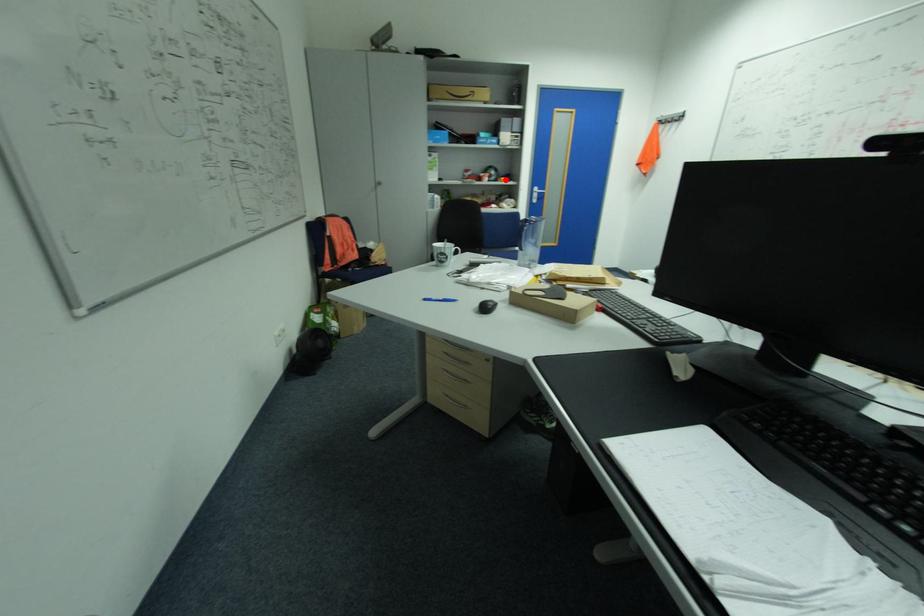
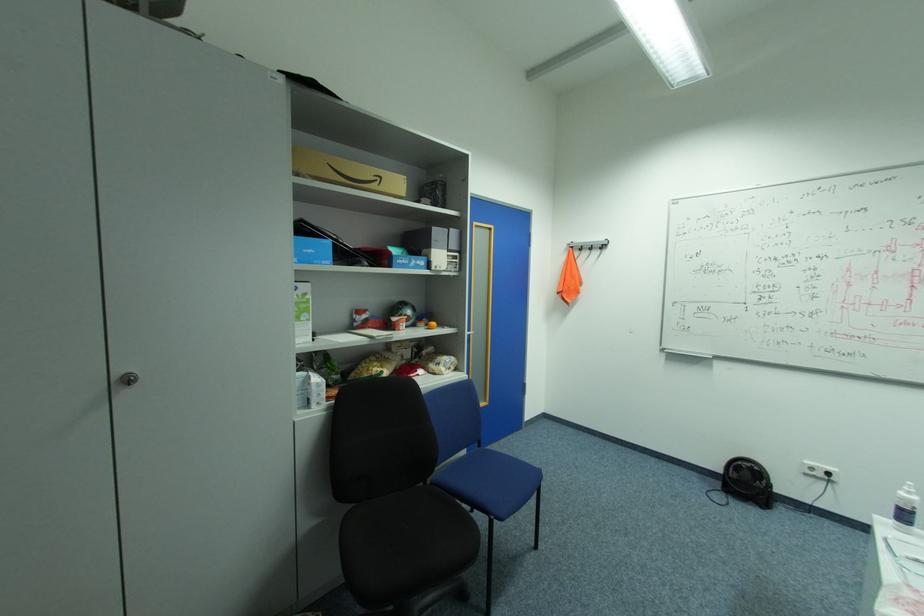
Question: I am providing you with two images of the same scene from different viewpoints. A red point is shown in image1. For the corresponding object point in image2, is it positioned nearer or farther from the camera?

Choices:
 (A) Nearer
 (B) Farther

Answer: (B)